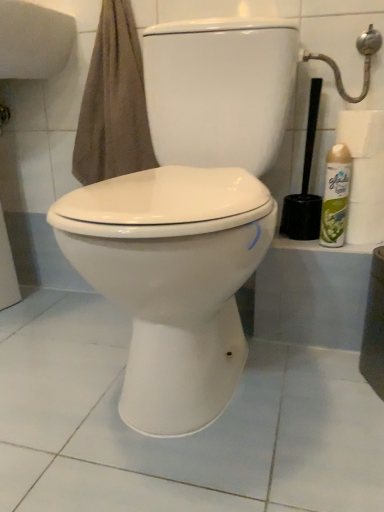
Question: Is white matte toilet paper at right, which is the first toilet paper from top to bottom, taller or shorter than white glossy toilet at center?

Choices:
 (A) tall
 (B) short

Answer: (B)

Question: In the image, is white matte toilet paper at right, the second toilet paper ordered from the bottom, on the left side or the right side of white glossy toilet at center?

Choices:
 (A) left
 (B) right

Answer: (B)

Question: Considering the real-world distances, which object is closest to the black plastic toilet brush at right?

Choices:
 (A) white matte toilet paper at right, the second toilet paper ordered from the bottom
 (B) green spray can at right
 (C) white glossy toilet at center
 (D) white glossy toilet paper at right, arranged as the second toilet paper when viewed from the top
 (E) metallic silver showerhead at upper right

Answer: (B)

Question: Estimate the real-world distances between objects in this image. Which object is farther from the metallic silver showerhead at upper right?

Choices:
 (A) white glossy toilet paper at right, the first toilet paper from the bottom
 (B) white glossy toilet at center
 (C) white matte toilet paper at right, the second toilet paper ordered from the bottom
 (D) black plastic toilet brush at right
 (E) green spray can at right

Answer: (B)